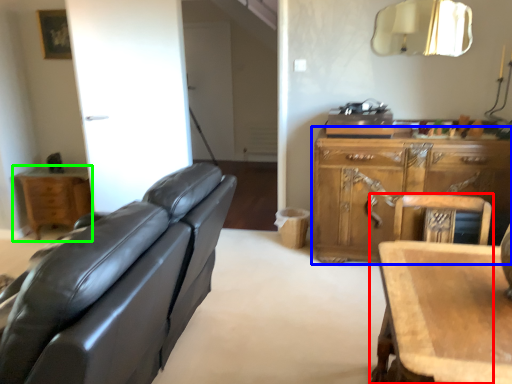
Question: Which object is positioned farthest from chair (highlighted by a red box)? Select from cabinetry (highlighted by a blue box) and nightstand (highlighted by a green box).

Choices:
 (A) cabinetry
 (B) nightstand

Answer: (B)